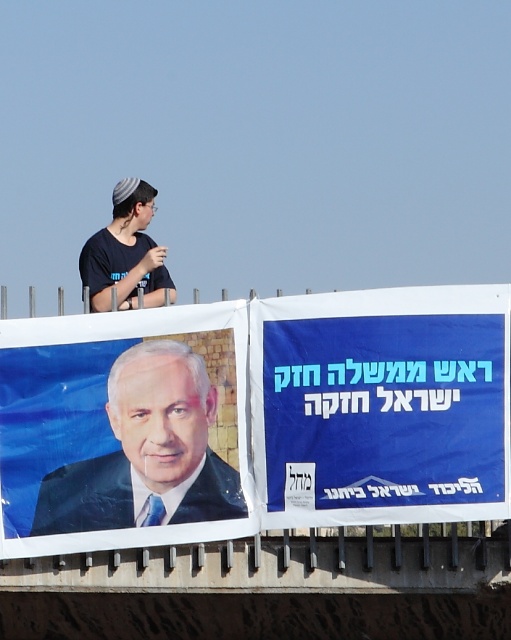
Does blue fabric banner at upper center come behind dark blue suit at center?

That is False.

Which is more to the left, blue fabric banner at upper center or dark blue suit at center?

From the viewer's perspective, dark blue suit at center appears more on the left side.

Image resolution: width=511 pixels, height=640 pixels. Describe the element at coordinates (382, 404) in the screenshot. I see `blue fabric banner at upper center` at that location.

Image resolution: width=511 pixels, height=640 pixels. What are the coordinates of `blue fabric banner at upper center` in the screenshot? It's located at (x=382, y=404).

Between point (470, 349) and point (251, 397), which one is positioned in front?

Point (470, 349) is more forward.

Measure the distance between point (479, 323) and camera.

Point (479, 323) is 41.90 meters away from camera.

At what (x,y) coordinates should I click in order to perform the action: click on blue fabric poster at upper center. Please return your answer as a coordinate pair (x, y). Looking at the image, I should click on (257, 419).

Is blue fabric poster at upper center closer to the viewer compared to dark blue suit at center?

Yes, it is in front of dark blue suit at center.

Is blue fabric poster at upper center taller than dark blue suit at center?

Indeed, blue fabric poster at upper center has a greater height compared to dark blue suit at center.

Find the location of a particular element. blue fabric poster at upper center is located at coordinates (257, 419).